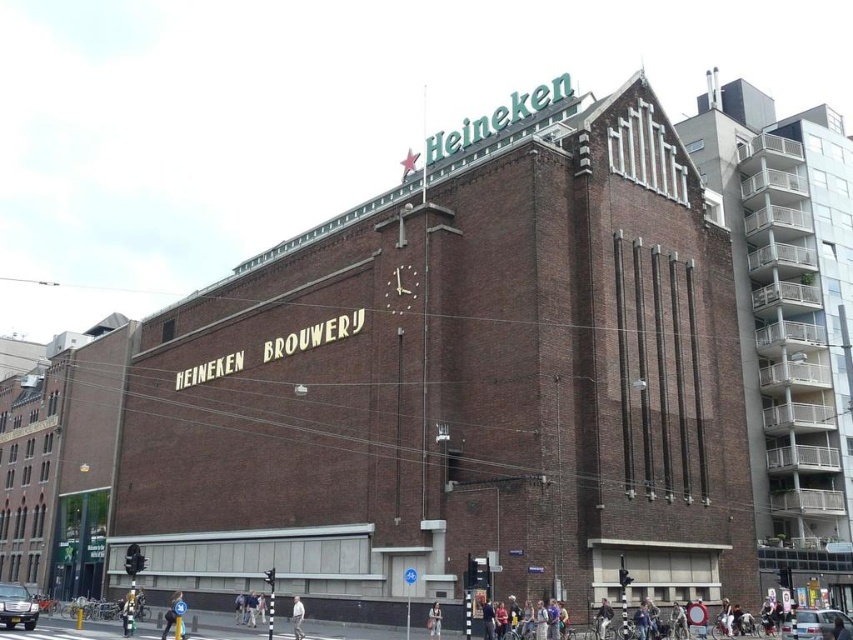
Does point (552, 624) come behind point (434, 625)?

No, (552, 624) is in front of (434, 625).

Which of these two, light blue jeans at center or denim jacket at center, stands taller?

denim jacket at center

Who is more distant from viewer, (532, 636) or (431, 616)?

Positioned behind is point (431, 616).

Where is `light blue jeans at center`? The image size is (853, 640). light blue jeans at center is located at coordinates (531, 625).

Does dark blue jeans at lower left appear under metallic star at upper center?

Yes, dark blue jeans at lower left is below metallic star at upper center.

Who is more distant from viewer, [131,602] or [413,154]?

Point [413,154]

Is point (120, 608) positioned before point (407, 154)?

Yes.

The image size is (853, 640). I want to click on dark blue jeans at lower left, so click(x=128, y=612).

Can you confirm if light blue jeans at center is smaller than dark blue jeans at lower left?

Yes.

Which of these two, light blue jeans at center or dark blue jeans at lower left, stands shorter?

light blue jeans at center

This screenshot has height=640, width=853. Find the location of `light blue jeans at center`. light blue jeans at center is located at coordinates (531, 625).